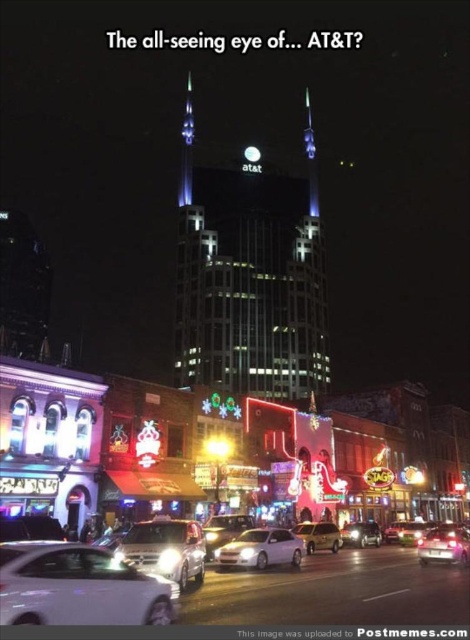
Does white glossy sedan at center have a lesser width compared to white matte sedan at center?

No, white glossy sedan at center is not thinner than white matte sedan at center.

Between point (318, 554) and point (260, 554), which one is positioned behind?

The point (318, 554) is more distant.

Between point (328, 563) and point (235, 563), which one is positioned in front?

Point (235, 563) is in front.

Identify the location of white glossy sedan at center. The height and width of the screenshot is (640, 470). (335, 592).

Between shiny gold car at center and shiny silver sedan at center, which one has more height?

shiny silver sedan at center

Which is below, shiny gold car at center or shiny silver sedan at center?

shiny silver sedan at center is below.

Is point (241, 518) behind point (360, 536)?

No, it is not.

You are a GUI agent. You are given a task and a screenshot of the screen. Output one action in this format:
    pyautogui.click(x=<x>, y=<y>)
    Task: Click on the shiny gold car at center
    The image size is (470, 640).
    Given the screenshot: What is the action you would take?
    coord(224,531)

Is white glossy sedan at center wider than white glossy sedan at lower left?

Yes, white glossy sedan at center is wider than white glossy sedan at lower left.

Does white glossy sedan at center come behind white glossy sedan at lower left?

That is True.

Who is more distant from viewer, [305,577] or [48,541]?

Positioned behind is point [305,577].

Find the location of `white glossy sedan at center`. white glossy sedan at center is located at coordinates (335, 592).